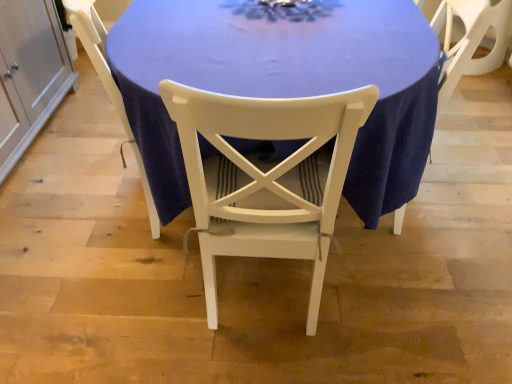
Question: Is white painted wood chair at center, marked as the 2th chair in a left-to-right arrangement, positioned beyond the bounds of white wood chair at center, the 1th chair positioned from the right?

Choices:
 (A) no
 (B) yes

Answer: (B)

Question: Is white painted wood chair at center, arranged as the 2th chair when viewed from the right, positioned far away from white wood chair at center, marked as the 3th chair in a left-to-right arrangement?

Choices:
 (A) yes
 (B) no

Answer: (B)

Question: Does white painted wood chair at center, marked as the 2th chair in a left-to-right arrangement, have a lesser height compared to white wood chair at center, marked as the 3th chair in a left-to-right arrangement?

Choices:
 (A) no
 (B) yes

Answer: (B)

Question: Does white painted wood chair at center, marked as the 2th chair in a left-to-right arrangement, appear on the left side of white wood chair at center, the 1th chair positioned from the right?

Choices:
 (A) no
 (B) yes

Answer: (B)

Question: Considering the relative sizes of white painted wood chair at center, arranged as the 2th chair when viewed from the right, and white wood chair at center, marked as the 3th chair in a left-to-right arrangement, in the image provided, is white painted wood chair at center, arranged as the 2th chair when viewed from the right, thinner than white wood chair at center, marked as the 3th chair in a left-to-right arrangement,?

Choices:
 (A) no
 (B) yes

Answer: (A)

Question: In terms of height, does white painted wood chair at center, arranged as the 2th chair when viewed from the right, look taller or shorter compared to white wood cabinet at left?

Choices:
 (A) short
 (B) tall

Answer: (B)

Question: Is point (215, 137) positioned closer to the camera than point (48, 104)?

Choices:
 (A) closer
 (B) farther

Answer: (A)

Question: Choose the correct answer: Is white painted wood chair at center, marked as the 2th chair in a left-to-right arrangement, inside white wood cabinet at left or outside it?

Choices:
 (A) outside
 (B) inside

Answer: (A)

Question: In the image, is white painted wood chair at center, marked as the 2th chair in a left-to-right arrangement, positioned in front of or behind white wood cabinet at left?

Choices:
 (A) behind
 (B) front

Answer: (B)

Question: From the image's perspective, is white wood chair at center, marked as the 1th chair in a left-to-right arrangement, located above or below blue fabric table at center?

Choices:
 (A) below
 (B) above

Answer: (A)

Question: Is white wood chair at center, marked as the 1th chair in a left-to-right arrangement, bigger or smaller than blue fabric table at center?

Choices:
 (A) big
 (B) small

Answer: (B)

Question: Does point (93, 0) appear closer or farther from the camera than point (141, 4)?

Choices:
 (A) closer
 (B) farther

Answer: (A)

Question: Looking at their shapes, would you say white wood chair at center, marked as the 1th chair in a left-to-right arrangement, is wider or thinner than blue fabric table at center?

Choices:
 (A) wide
 (B) thin

Answer: (B)

Question: From a real-world perspective, is white wood chair at center, marked as the 1th chair in a left-to-right arrangement, physically located above or below white wood cabinet at left?

Choices:
 (A) above
 (B) below

Answer: (A)

Question: From the image's perspective, is white wood chair at center, which ranks as the third chair in right-to-left order, located above or below white wood cabinet at left?

Choices:
 (A) below
 (B) above

Answer: (A)